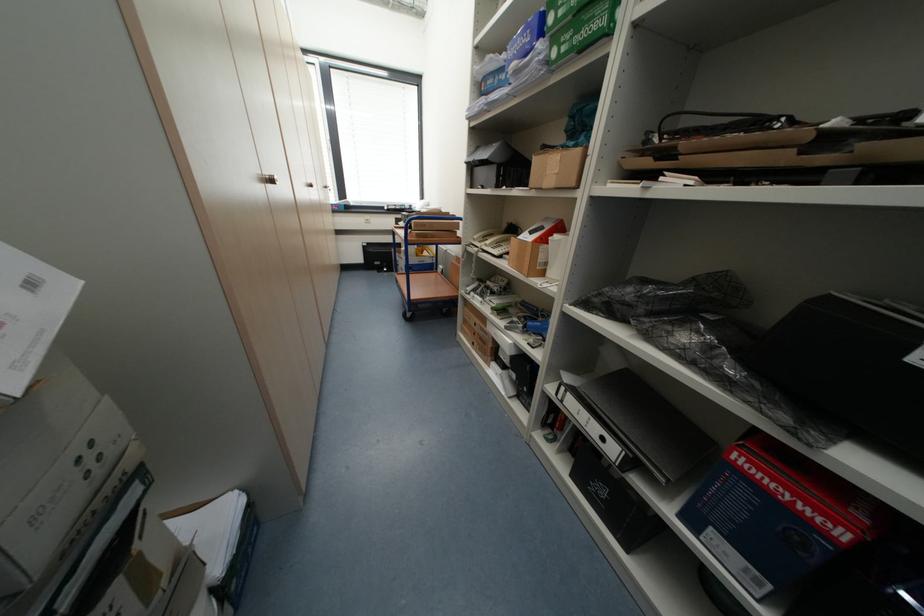
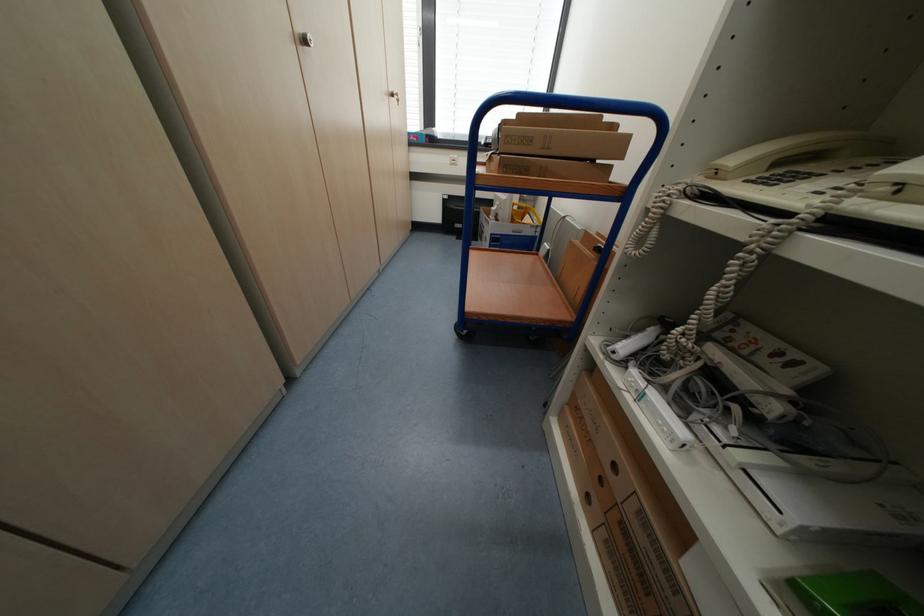
In the second image, find the point that corresponds to [482,297] in the first image.

(662, 398)